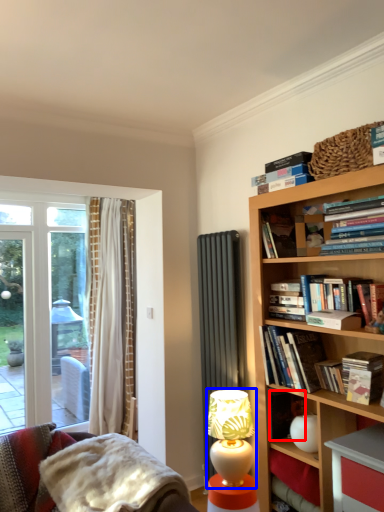
Question: Which object is further to the camera taking this photo, paperback book (highlighted by a red box) or table lamp (highlighted by a blue box)?

Choices:
 (A) paperback book
 (B) table lamp

Answer: (B)